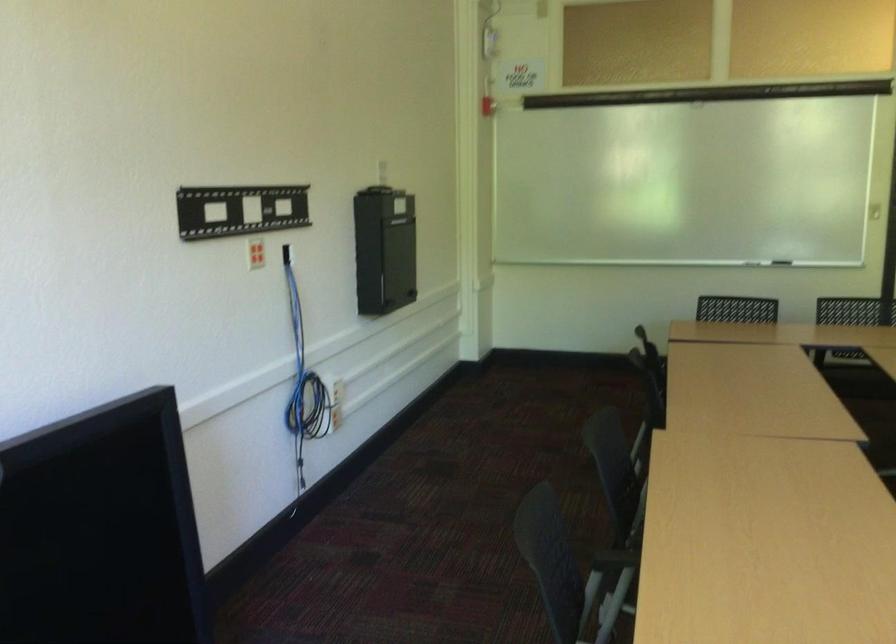
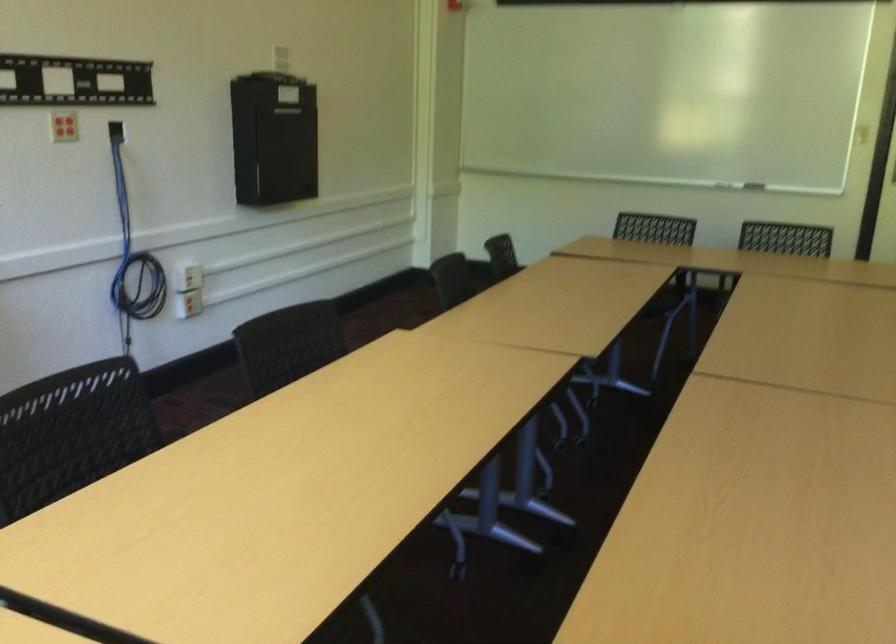
Locate, in the second image, the point that corresponds to point (298, 372) in the first image.

(133, 252)